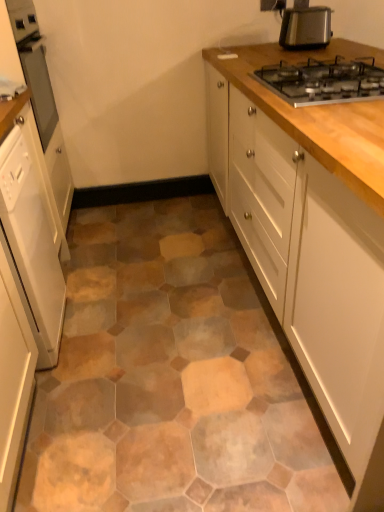
Question: In terms of size, does white glossy cabinet at left, the second cabinetry positioned from the right, appear bigger or smaller than white wood cabinet at upper right, which ranks as the 3th cabinetry in left-to-right order?

Choices:
 (A) big
 (B) small

Answer: (B)

Question: From a real-world perspective, is white glossy cabinet at left, the second cabinetry positioned from the right, positioned above or below white wood cabinet at upper right, arranged as the 1th cabinetry when viewed from the right?

Choices:
 (A) below
 (B) above

Answer: (A)

Question: Based on their relative distances, which object is farther from the metallic silver gas stove at upper right?

Choices:
 (A) white wood cabinet at upper right, which ranks as the 3th cabinetry in left-to-right order
 (B) white glossy dishwasher at left, which is the third cabinetry from right to left
 (C) matte glass oven at left
 (D) metallic silver toaster at upper right
 (E) white glossy cabinet at left, the second cabinetry positioned from the right

Answer: (C)

Question: Which is nearer to the white wood cabinet at upper right, arranged as the 1th cabinetry when viewed from the right?

Choices:
 (A) white glossy dishwasher at left, which is the third cabinetry from right to left
 (B) metallic silver toaster at upper right
 (C) metallic silver gas stove at upper right
 (D) matte glass oven at left
 (E) white glossy cabinet at left, the second cabinetry positioned from the right

Answer: (C)